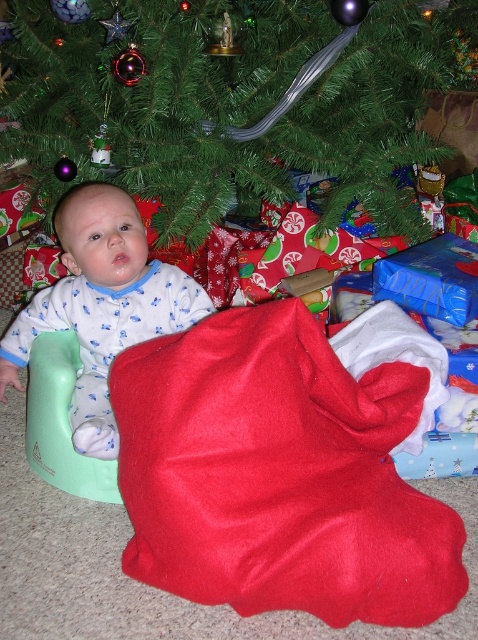
You are a drone operator trying to position a camera above the green matte christmas tree at center. The camera can only move in a straight line from its current position at point 0.2, 0.5. Will the camera be able to reach the tree without any obstruction?

The green matte christmas tree at center is located at point (230,100). The camera is at (239,128). The straight line distance between them is sqrt of squared differences in x and y coordinates. Calculating the distance between these two points would show if it can reach, but since the question is about obstruction, the description doesn

You are a parent trying to find the metallic silver ornament at upper center for your baby. The baby is wearing the matte blue pajamas at center. Can you hand the ornament to the baby without moving the baby?

The matte blue pajamas at center is in front of the metallic silver ornament at upper center, so you cannot directly hand the ornament to the baby without moving the baby because the ornament is behind the baby.